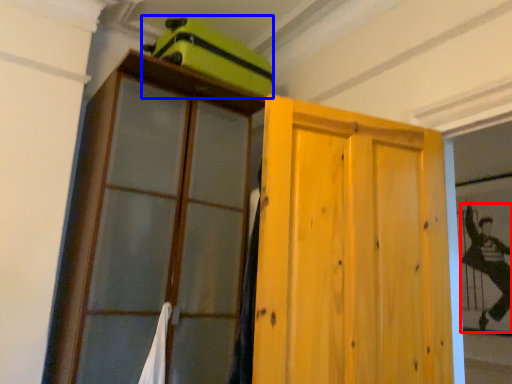
Question: Which object is closer to the camera taking this photo, couple (highlighted by a red box) or luggage (highlighted by a blue box)?

Choices:
 (A) couple
 (B) luggage

Answer: (B)